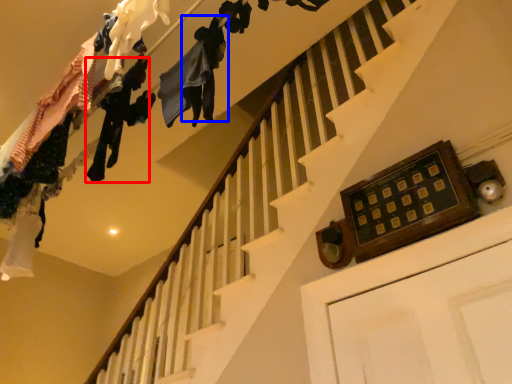
Question: Which object is closer to the camera taking this photo, clothing (highlighted by a red box) or clothing (highlighted by a blue box)?

Choices:
 (A) clothing
 (B) clothing

Answer: (B)